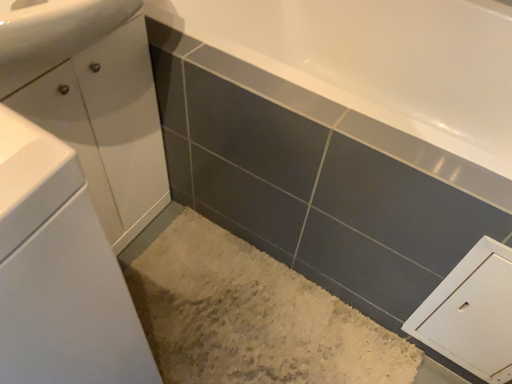
Locate an element on the screen. Image resolution: width=512 pixels, height=384 pixels. white matte cabinet at lower right is located at coordinates (472, 313).

You are a GUI agent. You are given a task and a screenshot of the screen. Output one action in this format:
    pyautogui.click(x=<x>, y=<y>)
    Task: Click on the white glossy cabinet at left, the 1th bathroom cabinet from the back
    The height and width of the screenshot is (384, 512).
    Given the screenshot: What is the action you would take?
    pyautogui.click(x=106, y=126)

Is white glossy cabinet at left, which ranks as the 2th bathroom cabinet in back-to-front order, not near white glossy cabinet at left, the 2th bathroom cabinet positioned from the front?

white glossy cabinet at left, which ranks as the 2th bathroom cabinet in back-to-front order, is actually quite close to white glossy cabinet at left, the 2th bathroom cabinet positioned from the front.

From the image's perspective, which is below, white glossy cabinet at left, the 1th bathroom cabinet when ordered from front to back, or white glossy cabinet at left, the 1th bathroom cabinet from the back?

white glossy cabinet at left, the 1th bathroom cabinet when ordered from front to back.

Is white glossy cabinet at left, the 1th bathroom cabinet when ordered from front to back, positioned in front of white glossy cabinet at left, the 2th bathroom cabinet positioned from the front?

Yes, it is in front of white glossy cabinet at left, the 2th bathroom cabinet positioned from the front.

Can you tell me how much white glossy cabinet at left, the 1th bathroom cabinet when ordered from front to back, and white glossy cabinet at left, the 1th bathroom cabinet from the back, differ in facing direction?

1.32 degrees.

In the scene shown: From the image's perspective, is white matte cabinet at lower right positioned above or below white glossy cabinet at left, the 1th bathroom cabinet from the back?

white matte cabinet at lower right is situated lower than white glossy cabinet at left, the 1th bathroom cabinet from the back, in the image.

Is white matte cabinet at lower right wider or thinner than white glossy cabinet at left, the 2th bathroom cabinet positioned from the front?

Considering their sizes, white matte cabinet at lower right looks slimmer than white glossy cabinet at left, the 2th bathroom cabinet positioned from the front.

From a real-world perspective, is white matte cabinet at lower right above or below white glossy cabinet at left, the 2th bathroom cabinet positioned from the front?

white matte cabinet at lower right is situated lower than white glossy cabinet at left, the 2th bathroom cabinet positioned from the front, in the real world.

Could you tell me if white matte cabinet at lower right is facing white glossy cabinet at left, the 2th bathroom cabinet positioned from the front?

No, white matte cabinet at lower right is not turned towards white glossy cabinet at left, the 2th bathroom cabinet positioned from the front.

From a real-world perspective, between white glossy cabinet at left, the 1th bathroom cabinet from the back, and white matte cabinet at lower right, who is vertically lower?

white matte cabinet at lower right is physically lower.

Which is in front, point (145, 87) or point (494, 295)?

The point (494, 295) is closer.

Who is taller, white glossy cabinet at left, the 2th bathroom cabinet positioned from the front, or white glossy cabinet at left, which ranks as the 2th bathroom cabinet in back-to-front order?

With more height is white glossy cabinet at left, which ranks as the 2th bathroom cabinet in back-to-front order.

From the picture: Is white glossy cabinet at left, the 2th bathroom cabinet positioned from the front, turned away from white glossy cabinet at left, which ranks as the 2th bathroom cabinet in back-to-front order?

No, white glossy cabinet at left, which ranks as the 2th bathroom cabinet in back-to-front order, is not at the back of white glossy cabinet at left, the 2th bathroom cabinet positioned from the front.

Based on the photo, which is closer to the camera, (142, 83) or (123, 374)?

The point (123, 374) is closer to the camera.

Relative to white glossy cabinet at left, the 1th bathroom cabinet when ordered from front to back, is white glossy cabinet at left, the 1th bathroom cabinet from the back, in front or behind?

Visually, white glossy cabinet at left, the 1th bathroom cabinet from the back, is located behind white glossy cabinet at left, the 1th bathroom cabinet when ordered from front to back.

Is white glossy cabinet at left, the 1th bathroom cabinet when ordered from front to back, not inside white matte cabinet at lower right?

white glossy cabinet at left, the 1th bathroom cabinet when ordered from front to back, lies outside white matte cabinet at lower right's area.

Which point is more distant from viewer, (133,353) or (500,302)?

The point (500,302) is more distant.

Is white glossy cabinet at left, the 1th bathroom cabinet when ordered from front to back, looking in the opposite direction of white matte cabinet at lower right?

No, white matte cabinet at lower right is not at the back of white glossy cabinet at left, the 1th bathroom cabinet when ordered from front to back.

Between white glossy cabinet at left, which ranks as the 2th bathroom cabinet in back-to-front order, and white matte cabinet at lower right, which one has more height?

With more height is white glossy cabinet at left, which ranks as the 2th bathroom cabinet in back-to-front order.

Is white matte cabinet at lower right facing towards white glossy cabinet at left, which ranks as the 2th bathroom cabinet in back-to-front order?

No, white matte cabinet at lower right does not turn towards white glossy cabinet at left, which ranks as the 2th bathroom cabinet in back-to-front order.

Where is `cabinetry that is behind the white glossy cabinet at left, which ranks as the 2th bathroom cabinet in back-to-front order`? The width and height of the screenshot is (512, 384). cabinetry that is behind the white glossy cabinet at left, which ranks as the 2th bathroom cabinet in back-to-front order is located at coordinates pos(472,313).

Is white matte cabinet at lower right positioned far away from white glossy cabinet at left, the 1th bathroom cabinet when ordered from front to back?

No, there isn't a large distance between white matte cabinet at lower right and white glossy cabinet at left, the 1th bathroom cabinet when ordered from front to back.

Considering the sizes of objects white matte cabinet at lower right and white glossy cabinet at left, which ranks as the 2th bathroom cabinet in back-to-front order, in the image provided, who is thinner, white matte cabinet at lower right or white glossy cabinet at left, which ranks as the 2th bathroom cabinet in back-to-front order,?

white matte cabinet at lower right.

Where is `bathroom cabinet that appears in front of the white glossy cabinet at left, the 2th bathroom cabinet positioned from the front`? bathroom cabinet that appears in front of the white glossy cabinet at left, the 2th bathroom cabinet positioned from the front is located at coordinates (59, 272).

Where is `cabinetry located below the white glossy cabinet at left, the 1th bathroom cabinet from the back (from the image's perspective)`? The width and height of the screenshot is (512, 384). cabinetry located below the white glossy cabinet at left, the 1th bathroom cabinet from the back (from the image's perspective) is located at coordinates click(x=472, y=313).

Based on their spatial positions, is white matte cabinet at lower right or white glossy cabinet at left, the 1th bathroom cabinet from the back, further from white glossy cabinet at left, which ranks as the 2th bathroom cabinet in back-to-front order?

white matte cabinet at lower right is positioned further to the anchor white glossy cabinet at left, which ranks as the 2th bathroom cabinet in back-to-front order.

Looking at the image, which one is located closer to white matte cabinet at lower right, white glossy cabinet at left, which ranks as the 2th bathroom cabinet in back-to-front order, or white glossy cabinet at left, the 2th bathroom cabinet positioned from the front?

Among the two, white glossy cabinet at left, which ranks as the 2th bathroom cabinet in back-to-front order, is located nearer to white matte cabinet at lower right.

When comparing their distances from white glossy cabinet at left, the 1th bathroom cabinet from the back, does white glossy cabinet at left, which ranks as the 2th bathroom cabinet in back-to-front order, or white matte cabinet at lower right seem further?

Among the two, white matte cabinet at lower right is located further to white glossy cabinet at left, the 1th bathroom cabinet from the back.

Looking at the image, which one is located further to white glossy cabinet at left, the 1th bathroom cabinet when ordered from front to back, white glossy cabinet at left, the 1th bathroom cabinet from the back, or white matte cabinet at lower right?

white matte cabinet at lower right is positioned further to the anchor white glossy cabinet at left, the 1th bathroom cabinet when ordered from front to back.

Estimate the real-world distances between objects in this image. Which object is further from white glossy cabinet at left, the 1th bathroom cabinet from the back, white matte cabinet at lower right or white glossy cabinet at left, which ranks as the 2th bathroom cabinet in back-to-front order?

white matte cabinet at lower right is further to white glossy cabinet at left, the 1th bathroom cabinet from the back.

Consider the image. When comparing their distances from white matte cabinet at lower right, does white glossy cabinet at left, the 1th bathroom cabinet from the back, or white glossy cabinet at left, the 1th bathroom cabinet when ordered from front to back, seem further?

Among the two, white glossy cabinet at left, the 1th bathroom cabinet from the back, is located further to white matte cabinet at lower right.

Identify the location of bathroom cabinet between white glossy cabinet at left, the 1th bathroom cabinet when ordered from front to back, and white matte cabinet at lower right. This screenshot has width=512, height=384. (106, 126).